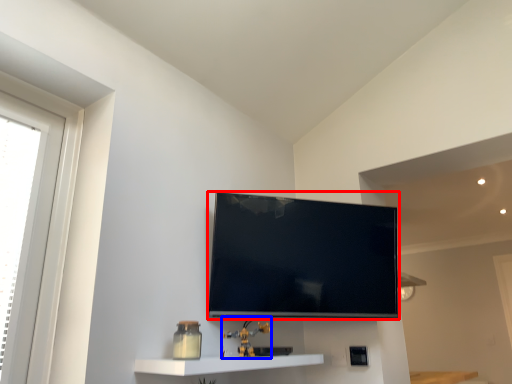
Question: Which object appears farthest to the camera in this image, television (highlighted by a red box) or toy (highlighted by a blue box)?

Choices:
 (A) television
 (B) toy

Answer: (A)